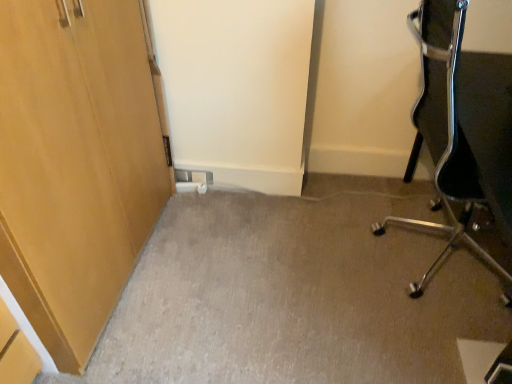
This screenshot has height=384, width=512. Describe the element at coordinates (461, 131) in the screenshot. I see `black mesh chair at right` at that location.

Locate an element on the screen. black mesh chair at right is located at coordinates (461, 131).

Identify the location of black mesh chair at right. The height and width of the screenshot is (384, 512). (461, 131).